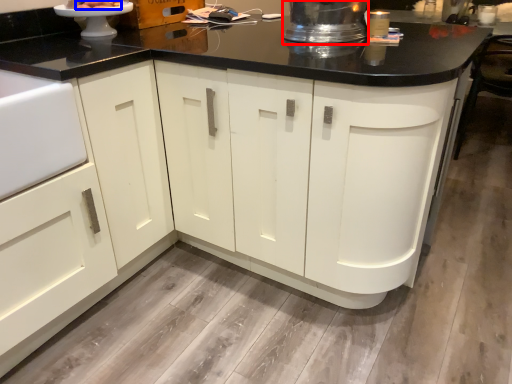
Question: Among these objects, which one is farthest to the camera, appliance (highlighted by a red box) or food (highlighted by a blue box)?

Choices:
 (A) appliance
 (B) food

Answer: (B)